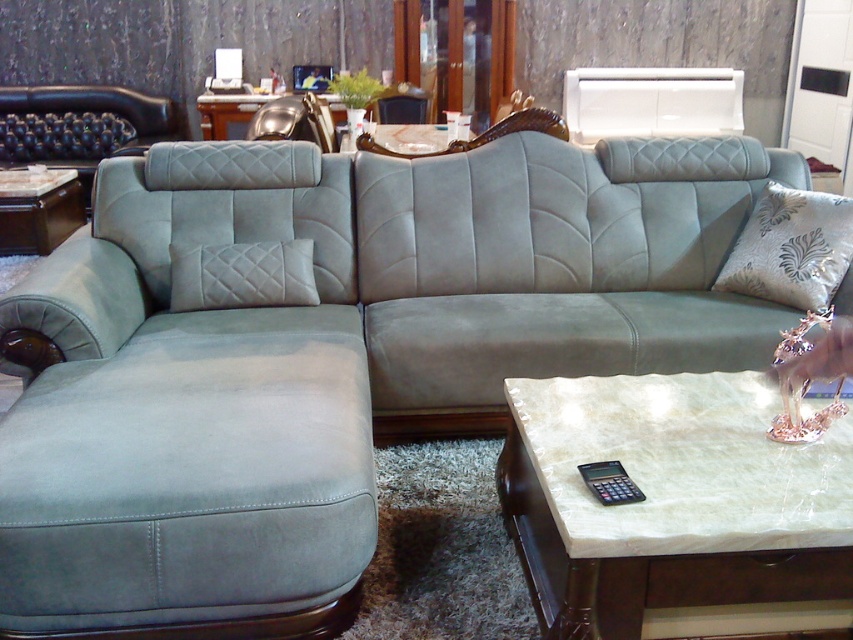
Question: Is suede couch at center to the right of metallic gold armchair at upper center from the viewer's perspective?

Choices:
 (A) no
 (B) yes

Answer: (B)

Question: Which point appears closest to the camera in this image?

Choices:
 (A) (802, 241)
 (B) (830, 364)
 (C) (318, 99)

Answer: (B)

Question: Can you confirm if suede/velvet pillow at center is positioned below metallic gold figurine at center?

Choices:
 (A) yes
 (B) no

Answer: (B)

Question: Which object is closer to the camera taking this photo?

Choices:
 (A) metallic gold armchair at upper center
 (B) matte black side table at left

Answer: (A)

Question: Can you confirm if suede couch at center is bigger than metallic gold armchair at upper center?

Choices:
 (A) no
 (B) yes

Answer: (B)

Question: Among these points, which one is farthest from the camera?

Choices:
 (A) (53, 218)
 (B) (836, 243)
 (C) (306, 124)

Answer: (A)